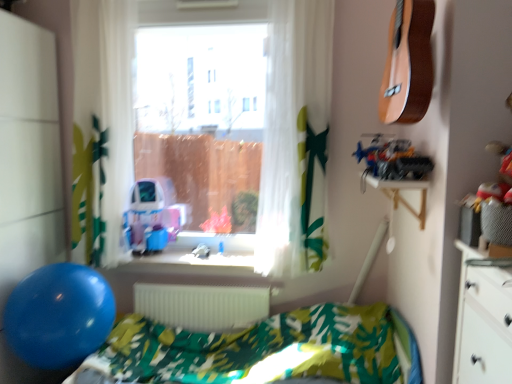
Question: Considering the relative sizes of translucent white curtain at center, which is counted as the 2th curtain, starting from the left, and blue plastic toy at center in the image provided, is translucent white curtain at center, which is counted as the 2th curtain, starting from the left, taller than blue plastic toy at center?

Choices:
 (A) no
 (B) yes

Answer: (B)

Question: Is blue plastic toy at center at the back of translucent white curtain at center, which is counted as the 2th curtain, starting from the left?

Choices:
 (A) no
 (B) yes

Answer: (A)

Question: Is translucent white curtain at center, which is counted as the 2th curtain, starting from the left, positioned behind blue plastic toy at center?

Choices:
 (A) no
 (B) yes

Answer: (A)

Question: Considering the relative sizes of translucent white curtain at center, the first curtain when ordered from right to left, and blue plastic toy at center in the image provided, is translucent white curtain at center, the first curtain when ordered from right to left, thinner than blue plastic toy at center?

Choices:
 (A) yes
 (B) no

Answer: (A)

Question: From a real-world perspective, is translucent white curtain at center, the first curtain when ordered from right to left, below blue plastic toy at center?

Choices:
 (A) yes
 (B) no

Answer: (B)

Question: From the image's perspective, is metallic silver toy car at upper right above or below white matte radiator at center?

Choices:
 (A) below
 (B) above

Answer: (B)

Question: Based on their sizes in the image, would you say metallic silver toy car at upper right is bigger or smaller than white matte radiator at center?

Choices:
 (A) big
 (B) small

Answer: (B)

Question: In terms of width, does metallic silver toy car at upper right look wider or thinner when compared to white matte radiator at center?

Choices:
 (A) wide
 (B) thin

Answer: (A)

Question: Considering the relative positions of metallic silver toy car at upper right and white matte radiator at center in the image provided, is metallic silver toy car at upper right to the left or to the right of white matte radiator at center?

Choices:
 (A) left
 (B) right

Answer: (B)

Question: Is translucent white curtain at center, the first curtain when ordered from right to left, inside or outside of white/sheer curtain at left, which ranks as the first curtain in left-to-right order?

Choices:
 (A) inside
 (B) outside

Answer: (B)

Question: Is point (276, 6) positioned closer to the camera than point (102, 124)?

Choices:
 (A) farther
 (B) closer

Answer: (B)

Question: Considering the positions of translucent white curtain at center, which is counted as the 2th curtain, starting from the left, and white/sheer curtain at left, which ranks as the first curtain in left-to-right order, in the image, is translucent white curtain at center, which is counted as the 2th curtain, starting from the left, bigger or smaller than white/sheer curtain at left, which ranks as the first curtain in left-to-right order,?

Choices:
 (A) small
 (B) big

Answer: (A)

Question: Is translucent white curtain at center, which is counted as the 2th curtain, starting from the left, to the left or to the right of white/sheer curtain at left, the second curtain viewed from the right, in the image?

Choices:
 (A) right
 (B) left

Answer: (A)

Question: Considering the positions of point (108, 299) and point (199, 312), is point (108, 299) closer or farther from the camera than point (199, 312)?

Choices:
 (A) farther
 (B) closer

Answer: (B)

Question: From the image's perspective, relative to white matte radiator at center, is blue rubber balloon at lower left above or below?

Choices:
 (A) below
 (B) above

Answer: (B)